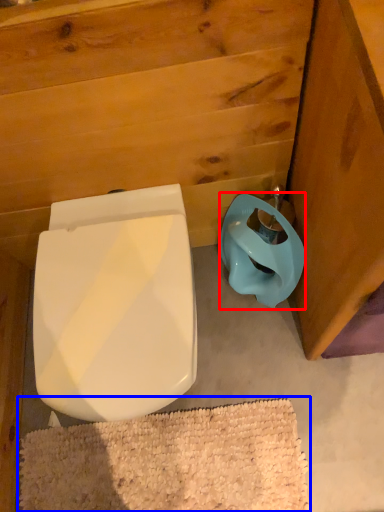
Question: Among these objects, which one is nearest to the camera, toilet bowl (highlighted by a red box) or bath mat (highlighted by a blue box)?

Choices:
 (A) toilet bowl
 (B) bath mat

Answer: (A)